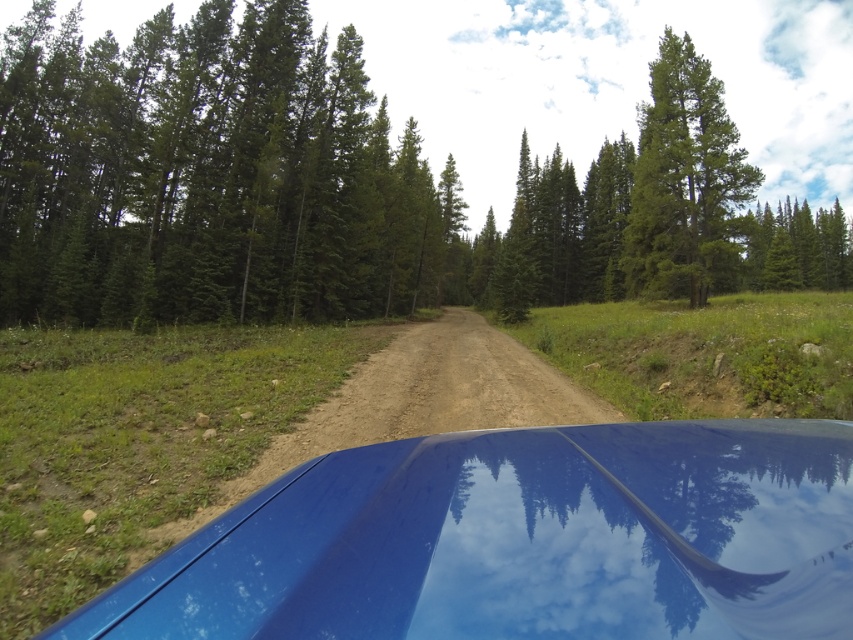
Looking at this image, you are sitting in the car and looking at the road ahead. There are two points marked on the road. The first is at coordinate point(x=210, y=236) and the second at point(x=502, y=467). Which point is closer to your current position inside the car?

Point(x=210, y=236) is closer to your current position inside the car because it is further to the camera than point(x=502, y=467).

You are driving a car and want to avoid hitting the tree. Based on the scene, which direction should you steer to move away from the green matte tree at center and the glossy blue car at center?

The green matte tree at center is to the right of the glossy blue car at center, so you should steer to the left to move away from both the tree and the car.